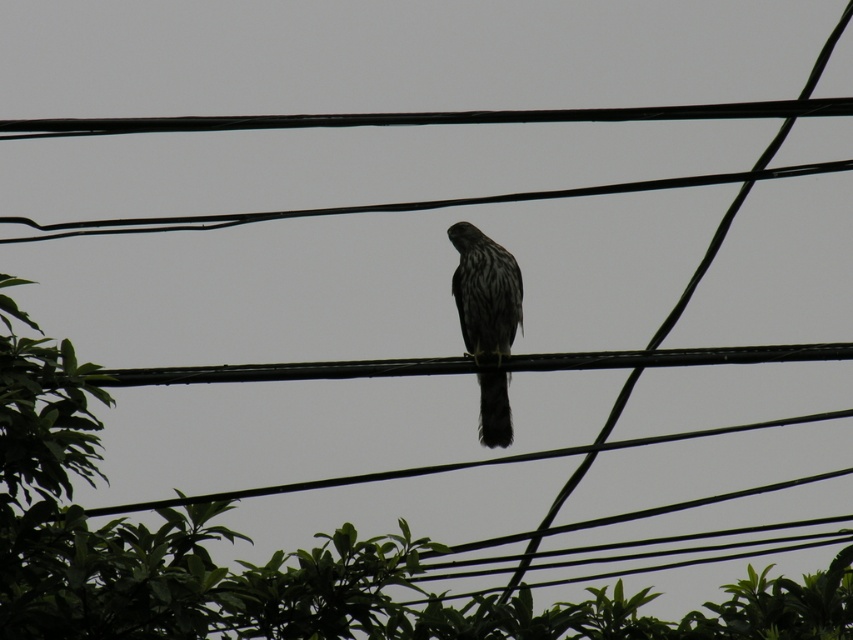
Which is above, green leafy tree at center or dark gray speckled falcon at center?

Positioned higher is dark gray speckled falcon at center.

Which of these two, green leafy tree at center or dark gray speckled falcon at center, stands taller?

With more height is green leafy tree at center.

At what (x,y) coordinates should I click in order to perform the action: click on green leafy tree at center. Please return your answer as a coordinate pair (x, y). Image resolution: width=853 pixels, height=640 pixels. Looking at the image, I should click on (273, 557).